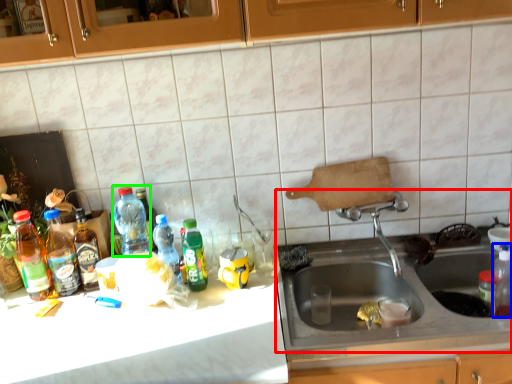
Question: Estimate the real-world distances between objects in this image. Which object is closer to sink (highlighted by a red box), bottle (highlighted by a blue box) or bottle (highlighted by a green box)?

Choices:
 (A) bottle
 (B) bottle

Answer: (A)